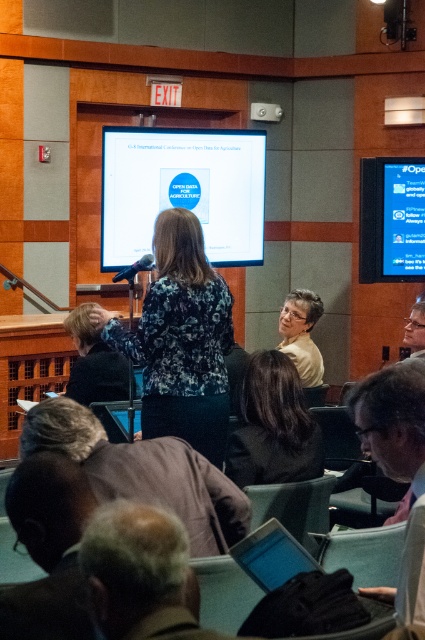
Question: Which of the following is the closest to the observer?

Choices:
 (A) brown fabric jacket at lower left
 (B) floral-patterned blouse at center

Answer: (A)

Question: Does dark brown hair at lower left have a lesser width compared to blue glossy screen at upper center?

Choices:
 (A) yes
 (B) no

Answer: (A)

Question: Which object is the farthest from the gray hair at lower center?

Choices:
 (A) black hair at center
 (B) white glossy projection screen at upper center
 (C) gray fabric at lower right

Answer: (B)

Question: Where is white glossy projection screen at upper center located in relation to dark brown hair at lower left in the image?

Choices:
 (A) below
 (B) above

Answer: (B)

Question: Which point is closer to the camera?

Choices:
 (A) (85, 433)
 (B) (184, 221)

Answer: (A)

Question: Is gray hair at lower center smaller than white matte shirt at center?

Choices:
 (A) yes
 (B) no

Answer: (A)